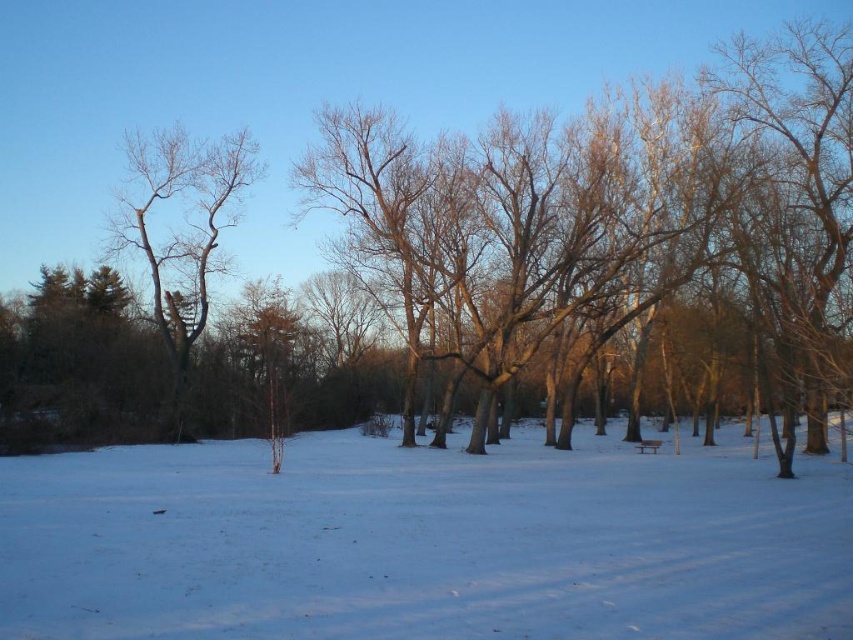
At what (x,y) coordinates should I click in order to perform the action: click on white powdery snow at center. Please return your answer as a coordinate pair (x, y). This screenshot has height=640, width=853. Looking at the image, I should click on (422, 541).

Is point (500, 605) farther from camera compared to point (242, 156)?

No, it is not.

The width and height of the screenshot is (853, 640). I want to click on white powdery snow at center, so click(x=422, y=541).